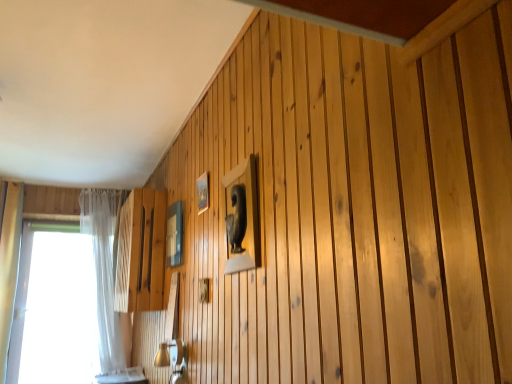
Question: Considering the positions of point (101, 317) and point (202, 210), is point (101, 317) closer or farther from the camera than point (202, 210)?

Choices:
 (A) closer
 (B) farther

Answer: (B)

Question: Choose the correct answer: Is white sheer curtain at left inside wooden frame at upper center, the 1th picture frame positioned from the right, or outside it?

Choices:
 (A) outside
 (B) inside

Answer: (A)

Question: Which object is the closest to the matte glass picture frame at upper center, arranged as the first picture frame when viewed from the back?

Choices:
 (A) wooden frame at upper center, marked as the 2th picture frame in a left-to-right arrangement
 (B) white sheer curtain at left
 (C) transparent glass window at left

Answer: (A)

Question: Estimate the real-world distances between objects in this image. Which object is closer to the transparent glass window at left?

Choices:
 (A) matte glass picture frame at upper center, which ranks as the 1th picture frame in left-to-right order
 (B) wooden frame at upper center, marked as the 2th picture frame in a left-to-right arrangement
 (C) white sheer curtain at left

Answer: (C)